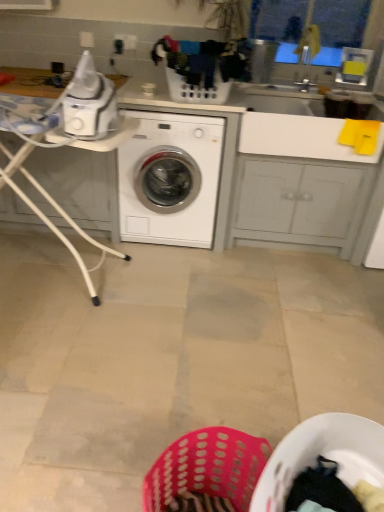
Question: Is the depth of white plastic laundry basket at center greater than that of white plastic table at left?

Choices:
 (A) no
 (B) yes

Answer: (B)

Question: Can you confirm if white plastic laundry basket at center is bigger than white plastic table at left?

Choices:
 (A) no
 (B) yes

Answer: (A)

Question: From a real-world perspective, is white plastic laundry basket at center positioned under white plastic table at left based on gravity?

Choices:
 (A) yes
 (B) no

Answer: (B)

Question: Is white plastic table at left inside white plastic laundry basket at center?

Choices:
 (A) no
 (B) yes

Answer: (A)

Question: Is white plastic laundry basket at center far away from white plastic table at left?

Choices:
 (A) no
 (B) yes

Answer: (A)

Question: Considering the relative positions of white plastic laundry basket at center and white plastic table at left in the image provided, is white plastic laundry basket at center in front of white plastic table at left?

Choices:
 (A) yes
 (B) no

Answer: (B)

Question: Is white glossy washing machine at center further to camera compared to white glossy counter top at upper left?

Choices:
 (A) no
 (B) yes

Answer: (A)

Question: Is white glossy washing machine at center far from white glossy counter top at upper left?

Choices:
 (A) yes
 (B) no

Answer: (B)

Question: Is white glossy washing machine at center smaller than white glossy counter top at upper left?

Choices:
 (A) no
 (B) yes

Answer: (B)

Question: Considering the relative positions of white glossy washing machine at center and white glossy counter top at upper left in the image provided, is white glossy washing machine at center to the left of white glossy counter top at upper left from the viewer's perspective?

Choices:
 (A) yes
 (B) no

Answer: (B)

Question: From a real-world perspective, is white glossy washing machine at center below white glossy counter top at upper left?

Choices:
 (A) yes
 (B) no

Answer: (A)

Question: From a real-world perspective, is white glossy washing machine at center on white glossy counter top at upper left?

Choices:
 (A) no
 (B) yes

Answer: (A)

Question: Is white glossy washing machine at center to the right of transparent plastic window screen at upper right from the viewer's perspective?

Choices:
 (A) no
 (B) yes

Answer: (A)